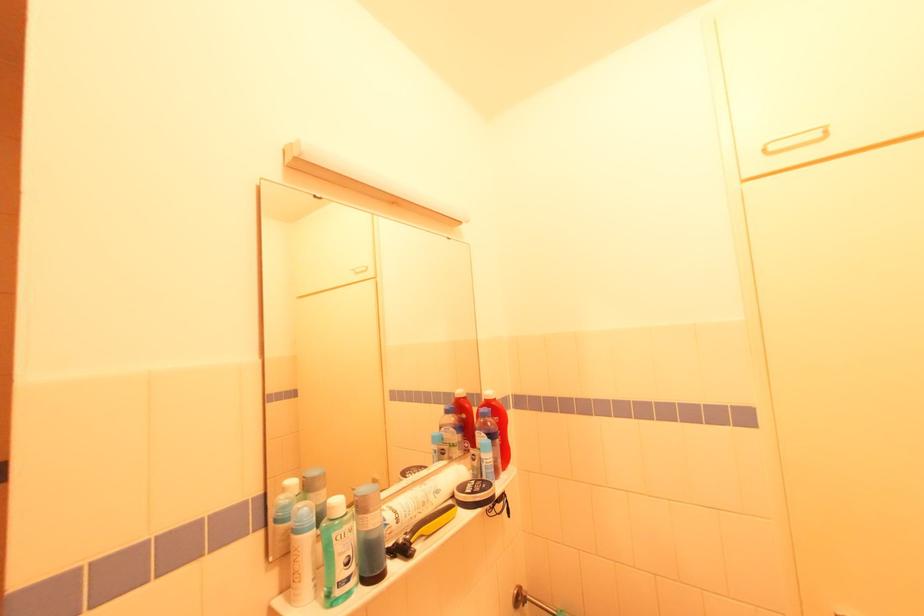
Find where to squeez the white plastic tube. Please return your answer as a coordinate pair (x, y).

(420, 500)